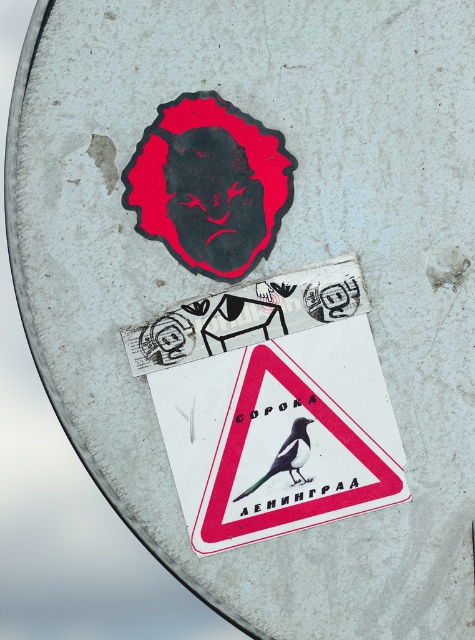
Is point (330, 404) positioned behind point (307, 438)?

No, (330, 404) is closer to viewer.

Is the position of white paper triangle at center more distant than that of green glossy bird at center?

No.

Locate an element on the screen. This screenshot has width=475, height=640. white paper triangle at center is located at coordinates (279, 435).